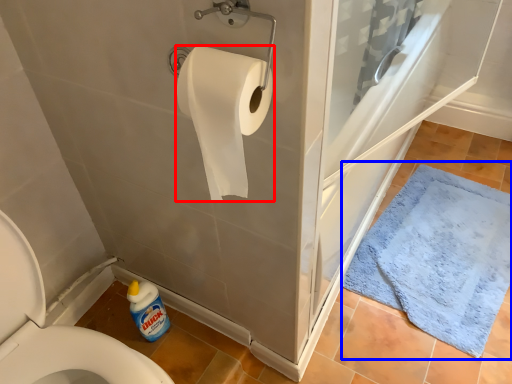
Question: Which point is closer to the camera, toilet paper (highlighted by a red box) or bath mat (highlighted by a blue box)?

Choices:
 (A) toilet paper
 (B) bath mat

Answer: (A)